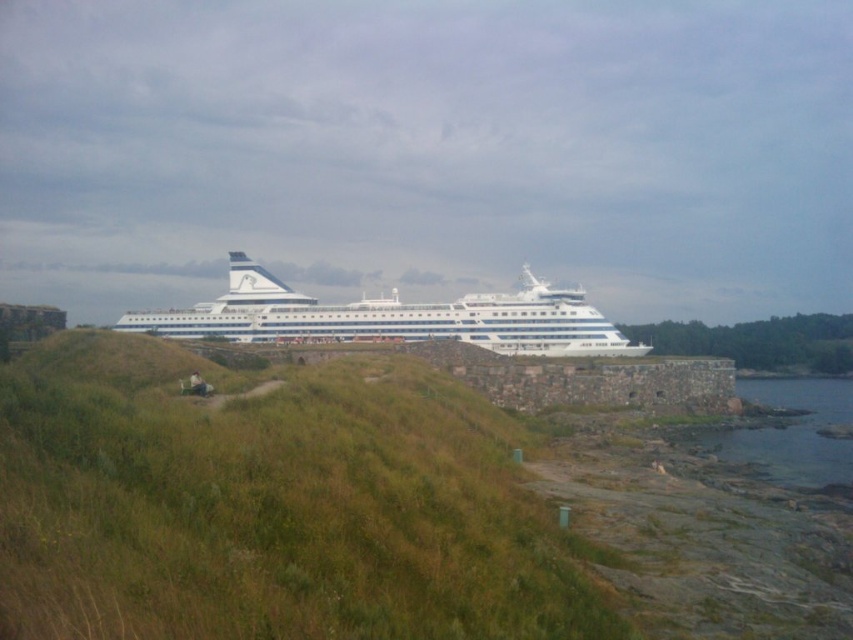
Question: Which object appears farthest from the camera in this image?

Choices:
 (A) green grassy at center
 (B) white glossy cruise ship at center

Answer: (B)

Question: Which object appears closest to the camera in this image?

Choices:
 (A) white glossy cruise ship at center
 (B) green grassy at center
 (C) clear water at lower right

Answer: (B)

Question: From the image, what is the correct spatial relationship of green grassy at center in relation to white glossy cruise ship at center?

Choices:
 (A) right
 (B) left

Answer: (B)

Question: Can you confirm if green grassy at center is wider than white glossy cruise ship at center?

Choices:
 (A) yes
 (B) no

Answer: (B)

Question: Which point is farther to the camera?

Choices:
 (A) (776, 424)
 (B) (393, 308)
 (C) (45, 586)

Answer: (B)

Question: Does green grassy at center have a lesser width compared to clear water at lower right?

Choices:
 (A) yes
 (B) no

Answer: (A)